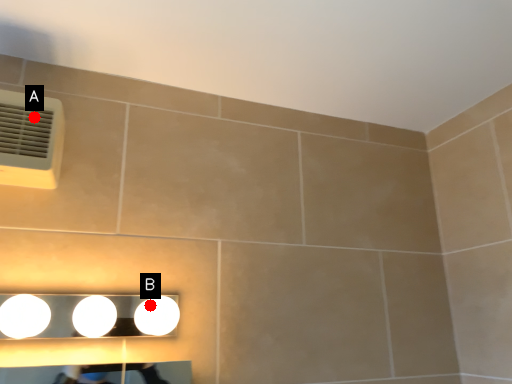
Question: Two points are circled on the image, labeled by A and B beside each circle. Among these points, which one is nearest to the camera?

Choices:
 (A) A is closer
 (B) B is closer

Answer: (B)